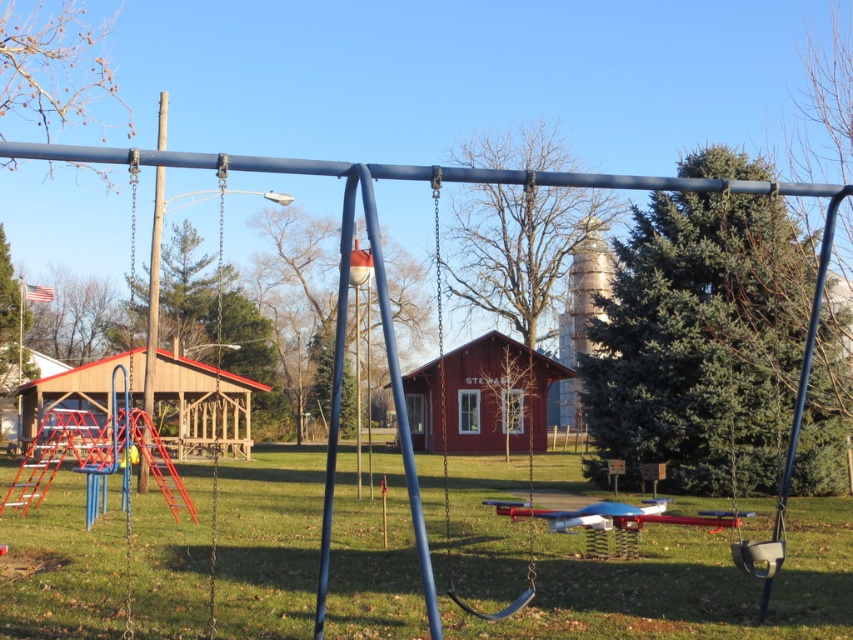
Who is shorter, green grass at center or metallic swing at center?

green grass at center

Which is behind, point (103, 632) or point (534, 566)?

Point (534, 566)

Is point (312, 545) positioned before point (442, 349)?

Yes, it is.

Identify the location of green grass at center. (672, 580).